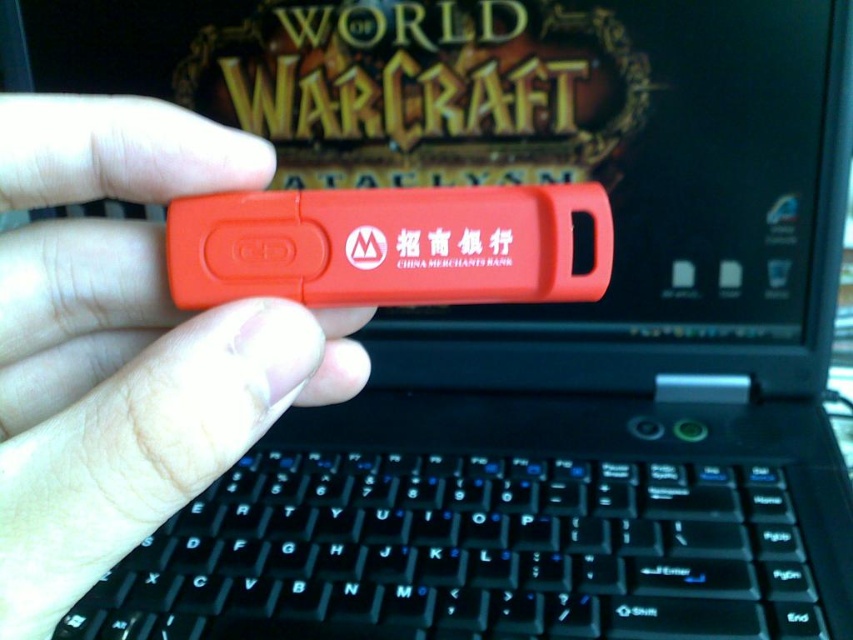
Is black plastic keyboard at center shorter than matte plastic usb drive at center?

Yes.

Does point (524, 580) come behind point (15, 168)?

That is True.

The width and height of the screenshot is (853, 640). In order to click on black plastic keyboard at center in this screenshot , I will do `click(474, 554)`.